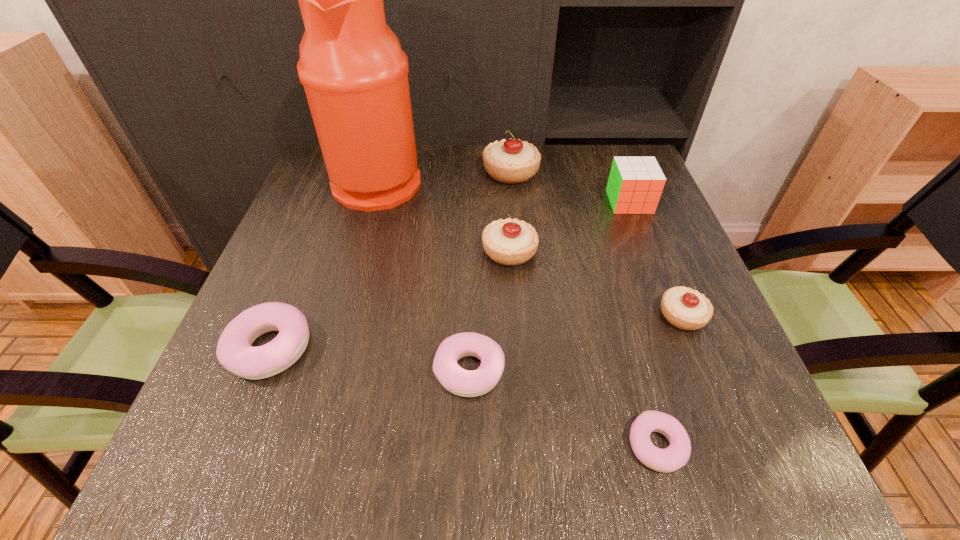
Find the location of a particular element. This screenshot has height=540, width=960. pastry that can be found as the fourth closest to the second shortest pastry is located at coordinates (687, 309).

The width and height of the screenshot is (960, 540). Identify the location of beige pastry that is the second closest one to the second pink pastry from left to right. (687, 309).

Select which beige pastry is the second closest to the nearest object. Please provide its 2D coordinates. Your answer should be formatted as a tuple, i.e. [(x, y)], where the tuple contains the x and y coordinates of a point satisfying the conditions above.

[(510, 242)]

Locate an element on the screen. The image size is (960, 540). pink pastry that is the closest to the leftmost pink pastry is located at coordinates (461, 382).

I want to click on pink pastry that is the second nearest to the fifth pastry from left to right, so click(x=234, y=351).

At what (x,y) coordinates should I click in order to perform the action: click on vacant space that satisfies the following two spatial constraints: 1. on the back side of the biggest pink pastry; 2. on the right side of the rightmost beige pastry. Please return your answer as a coordinate pair (x, y). Looking at the image, I should click on (283, 316).

The image size is (960, 540). I want to click on vacant region that satisfies the following two spatial constraints: 1. on the back side of the fifth tallest object; 2. on the left side of the nearest pastry, so click(x=620, y=316).

This screenshot has height=540, width=960. I want to click on free region that satisfies the following two spatial constraints: 1. from the spout of the fifth tallest pastry; 2. on the right side of the water jug, so click(324, 370).

The image size is (960, 540). I want to click on vacant space that satisfies the following two spatial constraints: 1. on the back side of the second pink pastry from left to right; 2. on the right side of the cube, so (472, 202).

You are a GUI agent. You are given a task and a screenshot of the screen. Output one action in this format:
    pyautogui.click(x=<x>, y=<y>)
    Task: Click on the vacant point that satisfies the following two spatial constraints: 1. on the back side of the leftmost pink pastry; 2. on the right side of the smallest beige pastry
    
    Given the screenshot: What is the action you would take?
    pyautogui.click(x=283, y=316)